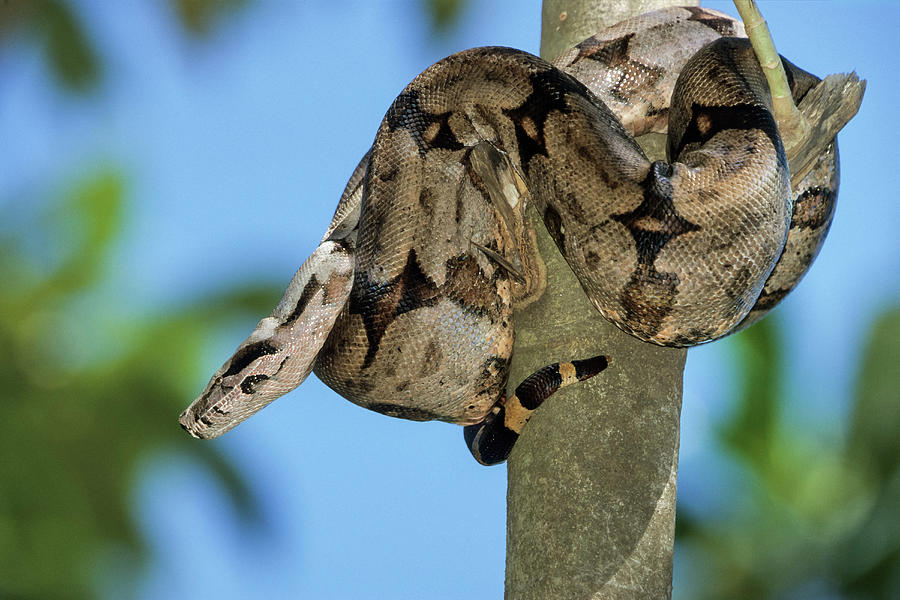
Locate an element on the screen. scales is located at coordinates (313, 332).